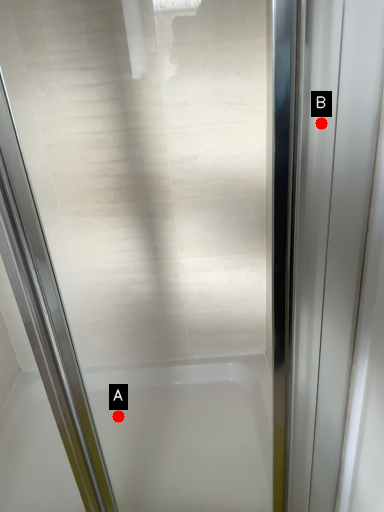
Question: Two points are circled on the image, labeled by A and B beside each circle. Which point appears closest to the camera in this image?

Choices:
 (A) A is closer
 (B) B is closer

Answer: (B)